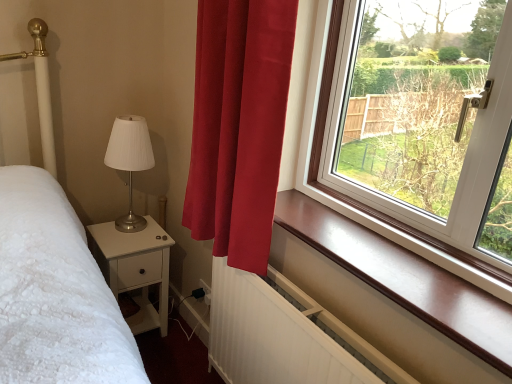
This screenshot has width=512, height=384. Describe the element at coordinates (394, 296) in the screenshot. I see `brown polished wood at upper right` at that location.

The image size is (512, 384). I want to click on white matte nightstand at lower left, so tap(135, 268).

Considering the points (131, 214) and (246, 246), which point is behind, point (131, 214) or point (246, 246)?

The point (131, 214) is farther from the camera.

Is matte silver table lamp at left not close to satin red curtain at center?

matte silver table lamp at left is near satin red curtain at center, not far away.

Considering the sizes of matte silver table lamp at left and satin red curtain at center in the image, is matte silver table lamp at left wider or thinner than satin red curtain at center?

In the image, matte silver table lamp at left appears to be wider than satin red curtain at center.

Is matte silver table lamp at left oriented away from satin red curtain at center?

No, satin red curtain at center is not at the back of matte silver table lamp at left.

Considering the relative sizes of brown polished wood at upper right and satin red curtain at center in the image provided, is brown polished wood at upper right wider than satin red curtain at center?

No.

Consider the image. Is brown polished wood at upper right positioned with its back to satin red curtain at center?

No, brown polished wood at upper right's orientation is not away from satin red curtain at center.

Is brown polished wood at upper right directly adjacent to satin red curtain at center?

No, brown polished wood at upper right is not in contact with satin red curtain at center.

Considering their positions, is brown polished wood at upper right located in front of or behind satin red curtain at center?

brown polished wood at upper right is in front of satin red curtain at center.

Which is nearer, (110, 272) or (140, 140)?

The point (140, 140) is in front.

Is white matte nightstand at lower left taller than matte silver table lamp at left?

Yes.

Which object is positioned more to the left, white matte nightstand at lower left or matte silver table lamp at left?

From the viewer's perspective, white matte nightstand at lower left appears more on the left side.

Is matte silver table lamp at left surrounded by white matte nightstand at lower left?

No, matte silver table lamp at left is located outside of white matte nightstand at lower left.

Which of these two, satin red curtain at center or brown polished wood at upper right, is thinner?

brown polished wood at upper right.

Does satin red curtain at center come behind brown polished wood at upper right?

Yes, satin red curtain at center is behind brown polished wood at upper right.

Can you tell me how much satin red curtain at center and brown polished wood at upper right differ in facing direction?

They differ by 0.463 degrees in their facing directions.

Where is `curtain above the brown polished wood at upper right (from the image's perspective)`? curtain above the brown polished wood at upper right (from the image's perspective) is located at coordinates (239, 125).

Considering the relative sizes of satin red curtain at center and white textured radiator at lower center in the image provided, is satin red curtain at center bigger than white textured radiator at lower center?

Correct, satin red curtain at center is larger in size than white textured radiator at lower center.

How far apart are satin red curtain at center and white textured radiator at lower center?

The distance of satin red curtain at center from white textured radiator at lower center is 38.23 centimeters.

Considering the sizes of satin red curtain at center and white textured radiator at lower center in the image, is satin red curtain at center taller or shorter than white textured radiator at lower center?

In the image, satin red curtain at center appears to be taller than white textured radiator at lower center.

Is white textured radiator at lower center at the left side of brown polished wood at upper right?

Correct, you'll find white textured radiator at lower center to the left of brown polished wood at upper right.

Considering the sizes of objects white textured radiator at lower center and brown polished wood at upper right in the image provided, who is thinner, white textured radiator at lower center or brown polished wood at upper right?

With smaller width is white textured radiator at lower center.

Looking at this image, is the position of white textured radiator at lower center more distant than that of brown polished wood at upper right?

Yes, white textured radiator at lower center is further from the viewer.

Where is `radiator behind the brown polished wood at upper right`? The height and width of the screenshot is (384, 512). radiator behind the brown polished wood at upper right is located at coordinates (283, 335).

From a real-world perspective, is satin red curtain at center positioned under white matte nightstand at lower left based on gravity?

Actually, satin red curtain at center is physically above white matte nightstand at lower left in the real world.

Is satin red curtain at center next to white matte nightstand at lower left?

They are not placed beside each other.

Which point is more distant from viewer, (x=262, y=11) or (x=133, y=244)?

The point (x=133, y=244) is farther from the camera.

Is satin red curtain at center turned away from white matte nightstand at lower left?

satin red curtain at center is not turned away from white matte nightstand at lower left.

Locate an element on the screen. The height and width of the screenshot is (384, 512). curtain positioned vertically above the matte silver table lamp at left (from a real-world perspective) is located at coordinates (239, 125).

You are a GUI agent. You are given a task and a screenshot of the screen. Output one action in this format:
    pyautogui.click(x=<x>, y=<y>)
    Task: Click on the window sill beneath the satin red curtain at center (from a real-world perspective)
    The height and width of the screenshot is (384, 512).
    Given the screenshot: What is the action you would take?
    pyautogui.click(x=394, y=296)

Based on their spatial positions, is brown polished wood at upper right or matte silver table lamp at left further from satin red curtain at center?

Among the two, matte silver table lamp at left is located further to satin red curtain at center.

Which object lies nearer to the anchor point matte silver table lamp at left, brown polished wood at upper right or satin red curtain at center?

satin red curtain at center is positioned closer to the anchor matte silver table lamp at left.

When comparing their distances from white textured radiator at lower center, does matte silver table lamp at left or satin red curtain at center seem closer?

satin red curtain at center is closer to white textured radiator at lower center.

Considering their positions, is white matte nightstand at lower left positioned further to white textured radiator at lower center than brown polished wood at upper right?

white matte nightstand at lower left.

Based on their spatial positions, is satin red curtain at center or matte silver table lamp at left further from white textured radiator at lower center?

matte silver table lamp at left is further to white textured radiator at lower center.

When comparing their distances from white textured radiator at lower center, does white matte nightstand at lower left or satin red curtain at center seem closer?

Based on the image, satin red curtain at center appears to be nearer to white textured radiator at lower center.

Looking at the image, which one is located further to satin red curtain at center, white matte nightstand at lower left or brown polished wood at upper right?

white matte nightstand at lower left is positioned further to the anchor satin red curtain at center.

When comparing their distances from satin red curtain at center, does white textured radiator at lower center or white matte nightstand at lower left seem further?

Based on the image, white matte nightstand at lower left appears to be further to satin red curtain at center.

Where is `radiator located between brown polished wood at upper right and white matte nightstand at lower left in the depth direction`? radiator located between brown polished wood at upper right and white matte nightstand at lower left in the depth direction is located at coordinates (283, 335).

Find the location of a particular element. curtain between white textured radiator at lower center and white matte nightstand at lower left from front to back is located at coordinates (239, 125).

Where is `radiator between brown polished wood at upper right and matte silver table lamp at left from front to back`? This screenshot has width=512, height=384. radiator between brown polished wood at upper right and matte silver table lamp at left from front to back is located at coordinates (283, 335).

Identify the location of table lamp between brown polished wood at upper right and white matte nightstand at lower left in the front-back direction. Image resolution: width=512 pixels, height=384 pixels. (130, 161).